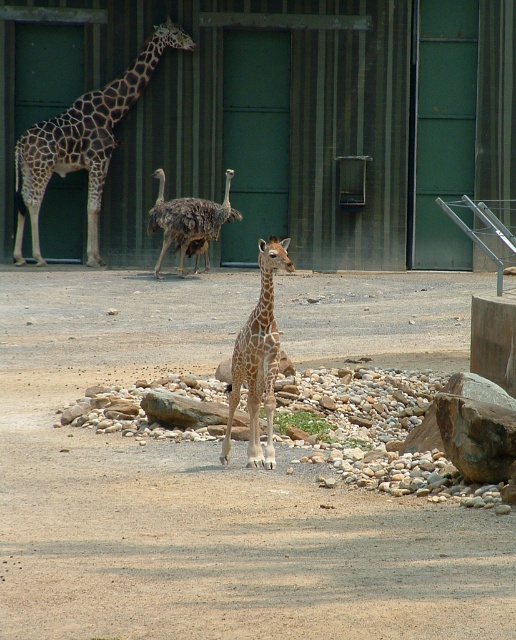
Question: Can you confirm if brown sandy dirt at center is positioned to the left of spotted fur giraffe at left?

Choices:
 (A) no
 (B) yes

Answer: (A)

Question: Estimate the real-world distances between objects in this image. Which object is closer to the spotted fur giraffe at center?

Choices:
 (A) brown sandy dirt at center
 (B) spotted fur giraffe at left
 (C) brown feathered ostrich at center

Answer: (A)

Question: Which point appears farthest from the camera in this image?

Choices:
 (A) (271, 243)
 (B) (315, 524)
 (C) (20, 243)
 (D) (163, 252)

Answer: (C)

Question: Does brown sandy dirt at center have a smaller size compared to spotted fur giraffe at left?

Choices:
 (A) no
 (B) yes

Answer: (A)

Question: Based on their relative distances, which object is farther from the spotted fur giraffe at center?

Choices:
 (A) spotted fur giraffe at left
 (B) brown sandy dirt at center
 (C) brown feathered ostrich at center

Answer: (A)

Question: Does spotted fur giraffe at left appear under brown feathered ostrich at center?

Choices:
 (A) no
 (B) yes

Answer: (A)